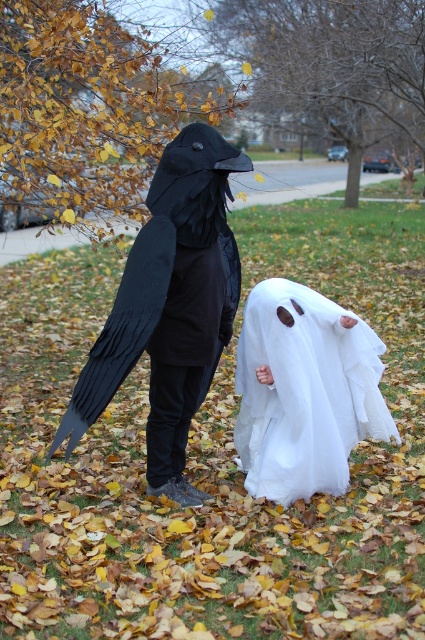
Question: Can you confirm if matte black bird at left is thinner than white sheer fabric ghost at lower center?

Choices:
 (A) yes
 (B) no

Answer: (B)

Question: Which object appears farthest from the camera in this image?

Choices:
 (A) white sheer fabric ghost at lower center
 (B) matte black bird at left

Answer: (A)

Question: Can you confirm if matte black bird at left is bigger than white sheer fabric ghost at lower center?

Choices:
 (A) no
 (B) yes

Answer: (B)

Question: Does matte black bird at left have a smaller size compared to white sheer fabric ghost at lower center?

Choices:
 (A) yes
 (B) no

Answer: (B)

Question: Which point is farther to the camera?

Choices:
 (A) matte black bird at left
 (B) white sheer fabric ghost at lower center

Answer: (B)